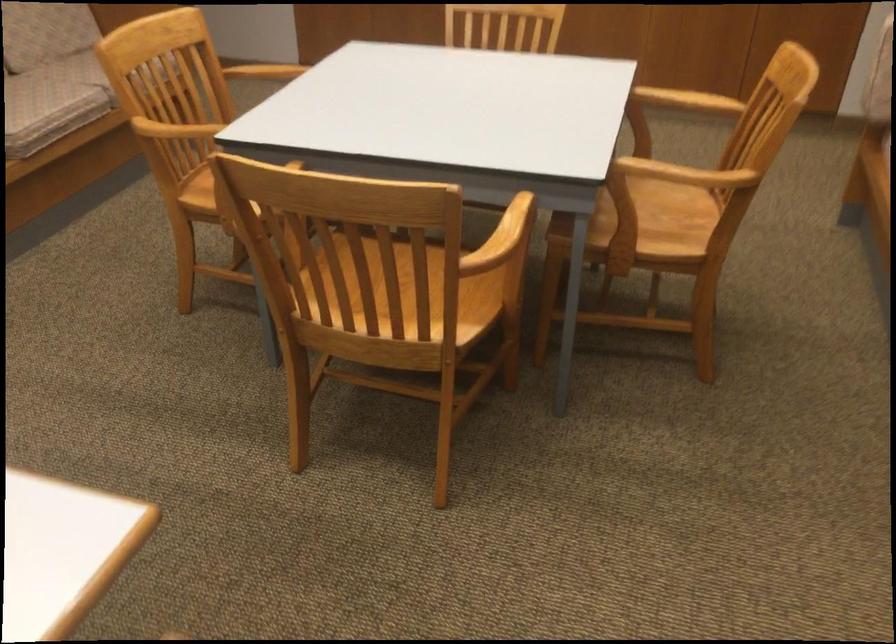
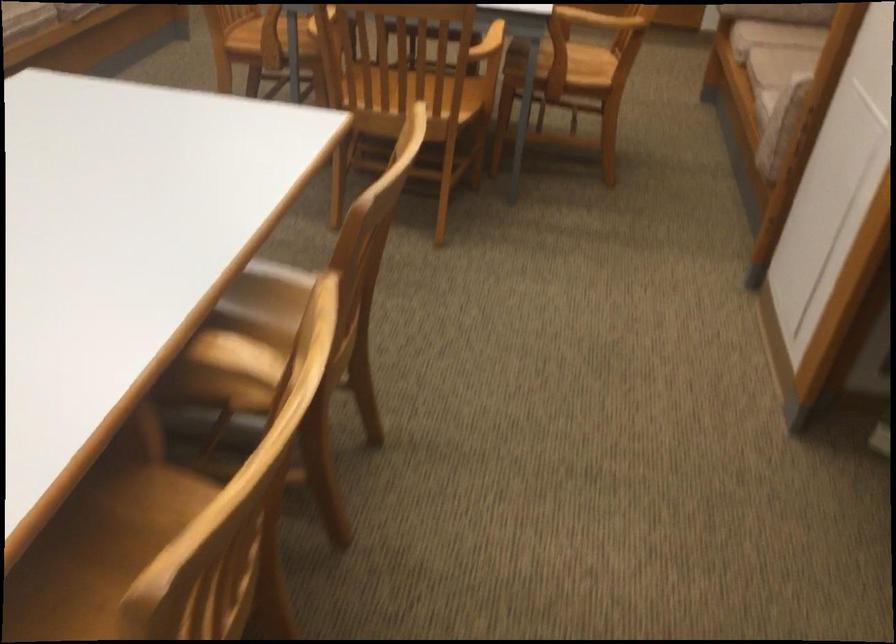
The point at (510, 248) is marked in the first image. Where is the corresponding point in the second image?

(488, 43)